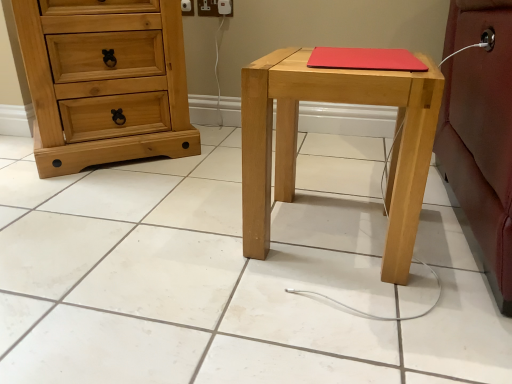
Where is `unoccupied area in front of natural wood chest of drawers at left`? The width and height of the screenshot is (512, 384). unoccupied area in front of natural wood chest of drawers at left is located at coordinates (104, 197).